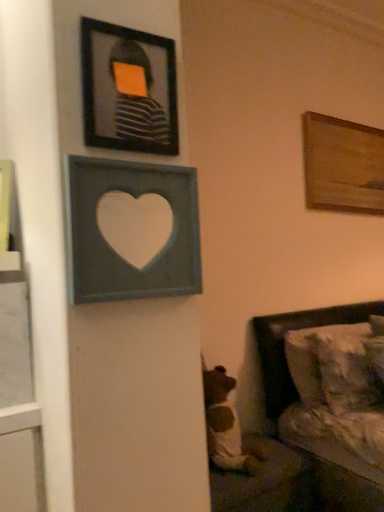
Question: From the image's perspective, is wooden painting at upper right, which appears as the first picture frame when viewed from the right, positioned above or below white textured pillow at lower right?

Choices:
 (A) above
 (B) below

Answer: (A)

Question: Looking at their shapes, would you say wooden painting at upper right, which appears as the first picture frame when viewed from the right, is wider or thinner than white textured pillow at lower right?

Choices:
 (A) thin
 (B) wide

Answer: (A)

Question: Estimate the real-world distances between objects in this image. Which object is closer to the matte black frame at upper left, acting as the second picture frame starting from the back?

Choices:
 (A) gray wood heart at upper center, placed as the 2th picture frame when sorted from right to left
 (B) white textured pillow at lower right
 (C) wooden painting at upper right, which appears as the first picture frame when viewed from the right
 (D) brown plush bear at lower center

Answer: (A)

Question: Which of these objects is positioned closest to the wooden painting at upper right, the third picture frame from the left?

Choices:
 (A) gray wood heart at upper center, the second picture frame viewed from the left
 (B) white textured pillow at lower right
 (C) matte black frame at upper left, positioned as the 2th picture frame in front-to-back order
 (D) brown plush bear at lower center

Answer: (B)